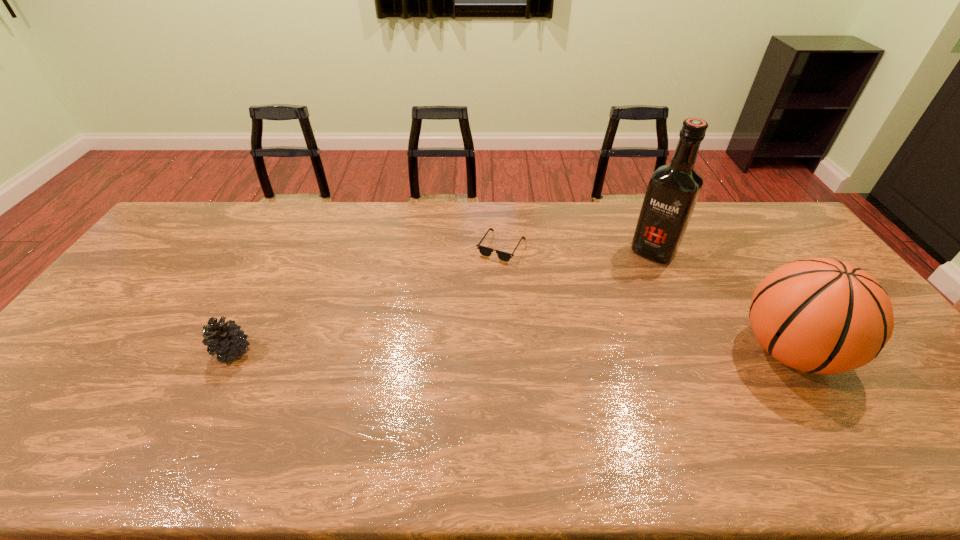
This screenshot has height=540, width=960. What are the coordinates of `free space that is in between the liquor and the pinecone` in the screenshot? It's located at (443, 301).

Locate an element on the screen. vacant area that lies between the second shortest object and the sunglasses is located at coordinates (367, 299).

Locate an element on the screen. vacant space that's between the third tallest object and the basketball is located at coordinates (512, 351).

Where is `free spot between the liquor and the shortest object`? This screenshot has width=960, height=540. free spot between the liquor and the shortest object is located at coordinates (577, 249).

I want to click on empty space between the rightmost object and the pinecone, so click(512, 351).

Locate an element on the screen. vacant area that lies between the rightmost object and the liquor is located at coordinates (721, 301).

Identify the location of the closest object to the shortest object. The image size is (960, 540). (673, 190).

Locate which object is the third closest to the pinecone. Please provide its 2D coordinates. Your answer should be formatted as a tuple, i.e. [(x, y)], where the tuple contains the x and y coordinates of a point satisfying the conditions above.

[(818, 315)]

Where is `free point that satisfies the following two spatial constraints: 1. on the back side of the basketball; 2. on the right side of the leftmost object`? The image size is (960, 540). free point that satisfies the following two spatial constraints: 1. on the back side of the basketball; 2. on the right side of the leftmost object is located at coordinates [233, 351].

Identify the location of vacant space that satisfies the following two spatial constraints: 1. on the front side of the tallest object; 2. on the left side of the rightmost object. (698, 351).